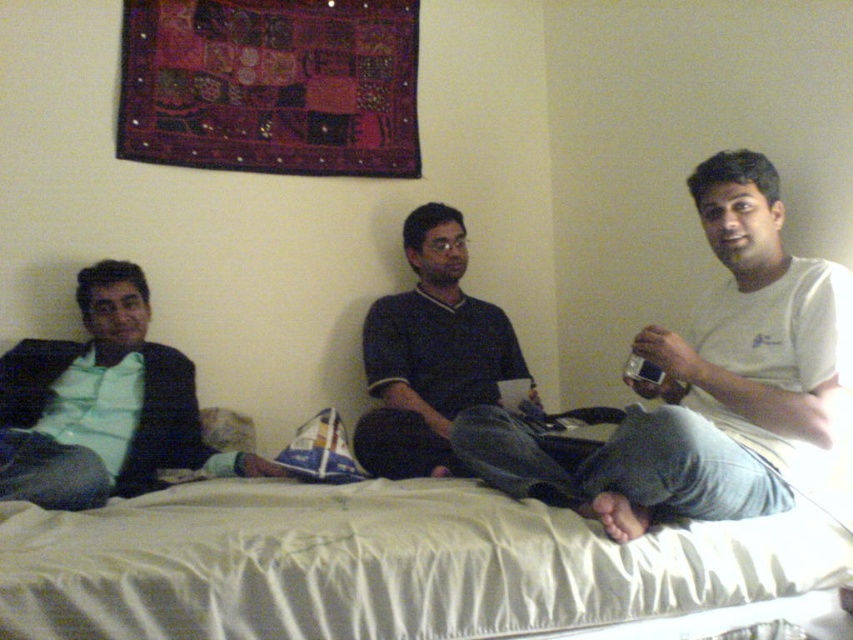
Can you confirm if green matte shirt at left is bigger than dark blue jersey at center?

No, green matte shirt at left is not bigger than dark blue jersey at center.

Between green matte shirt at left and dark blue jersey at center, which one has less height?

With less height is green matte shirt at left.

Identify the location of green matte shirt at left. This screenshot has width=853, height=640. (103, 404).

Where is `green matte shirt at left`? The image size is (853, 640). green matte shirt at left is located at coordinates (103, 404).

Image resolution: width=853 pixels, height=640 pixels. In order to click on white cotton shirt at center in this screenshot , I will do `click(733, 369)`.

From the picture: Does white cotton shirt at center have a lesser height compared to green matte shirt at left?

No.

Where is `white cotton shirt at center`? This screenshot has width=853, height=640. white cotton shirt at center is located at coordinates (733, 369).

Locate an element on the screen. white cotton shirt at center is located at coordinates (733, 369).

The image size is (853, 640). What do you see at coordinates (733, 369) in the screenshot?
I see `white cotton shirt at center` at bounding box center [733, 369].

Does white cotton shirt at center lie behind dark blue jersey at center?

That is False.

Locate an element on the screen. This screenshot has width=853, height=640. white cotton shirt at center is located at coordinates (733, 369).